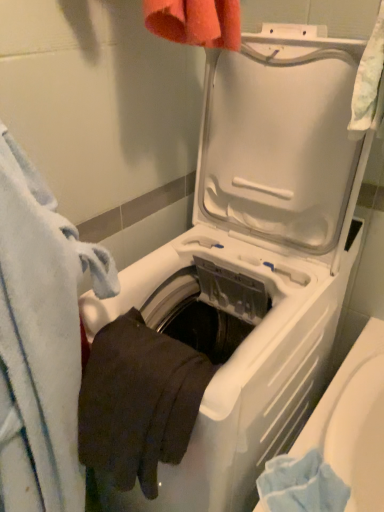
Question: Is blue soft towel at left positioned far away from dark cotton bath towel at lower left?

Choices:
 (A) yes
 (B) no

Answer: (B)

Question: Considering the relative sizes of blue soft towel at left and dark cotton bath towel at lower left in the image provided, is blue soft towel at left bigger than dark cotton bath towel at lower left?

Choices:
 (A) yes
 (B) no

Answer: (A)

Question: From a real-world perspective, is blue soft towel at left located higher than dark cotton bath towel at lower left?

Choices:
 (A) no
 (B) yes

Answer: (A)

Question: Is blue soft towel at left looking in the opposite direction of dark cotton bath towel at lower left?

Choices:
 (A) no
 (B) yes

Answer: (A)

Question: Is blue soft towel at left located outside dark cotton bath towel at lower left?

Choices:
 (A) no
 (B) yes

Answer: (B)

Question: From the image's perspective, does blue soft towel at left appear lower than dark cotton bath towel at lower left?

Choices:
 (A) yes
 (B) no

Answer: (A)

Question: Is dark cotton bath towel at lower left thinner than blue soft towel at left?

Choices:
 (A) yes
 (B) no

Answer: (A)

Question: Considering the relative sizes of dark cotton bath towel at lower left and blue soft towel at left in the image provided, is dark cotton bath towel at lower left taller than blue soft towel at left?

Choices:
 (A) yes
 (B) no

Answer: (B)

Question: Is dark cotton bath towel at lower left located outside blue soft towel at left?

Choices:
 (A) yes
 (B) no

Answer: (A)

Question: Is the depth of dark cotton bath towel at lower left greater than that of blue soft towel at left?

Choices:
 (A) no
 (B) yes

Answer: (B)

Question: Is blue soft towel at left inside dark cotton bath towel at lower left?

Choices:
 (A) no
 (B) yes

Answer: (A)

Question: Can you confirm if dark cotton bath towel at lower left is smaller than blue soft towel at left?

Choices:
 (A) no
 (B) yes

Answer: (B)

Question: From a real-world perspective, is blue soft towel at left above or below dark cotton bath towel at lower left?

Choices:
 (A) above
 (B) below

Answer: (B)